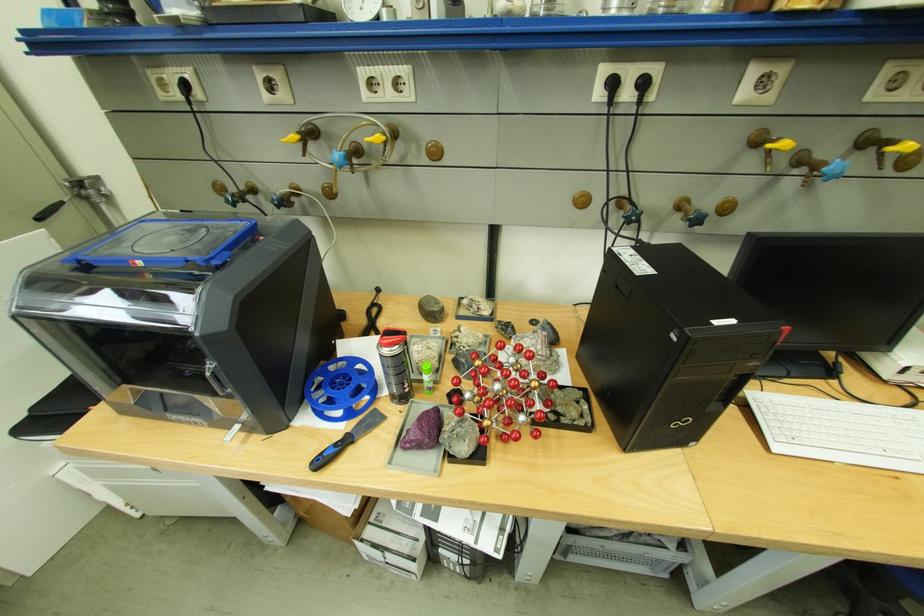
Locate an element on the screen. scraper handle is located at coordinates (331, 452).